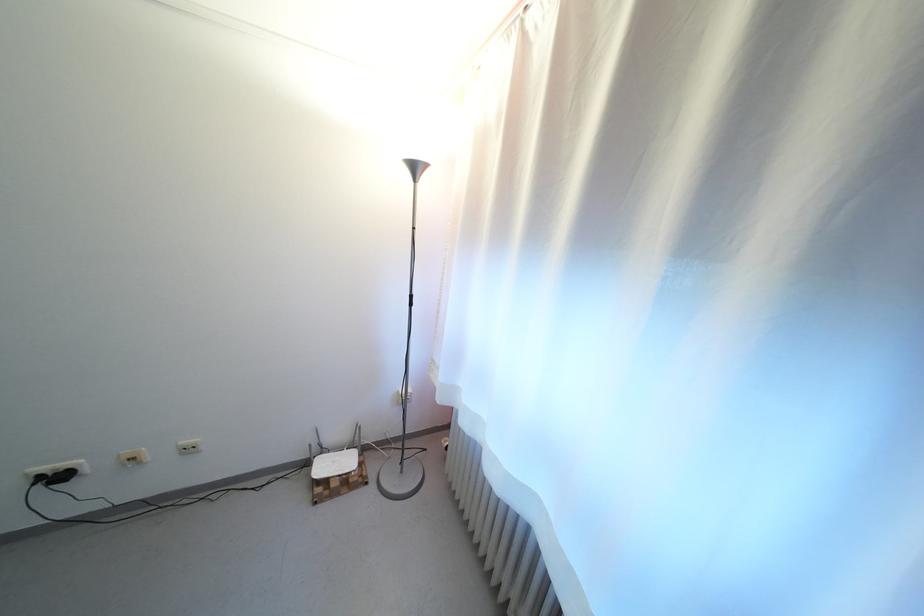
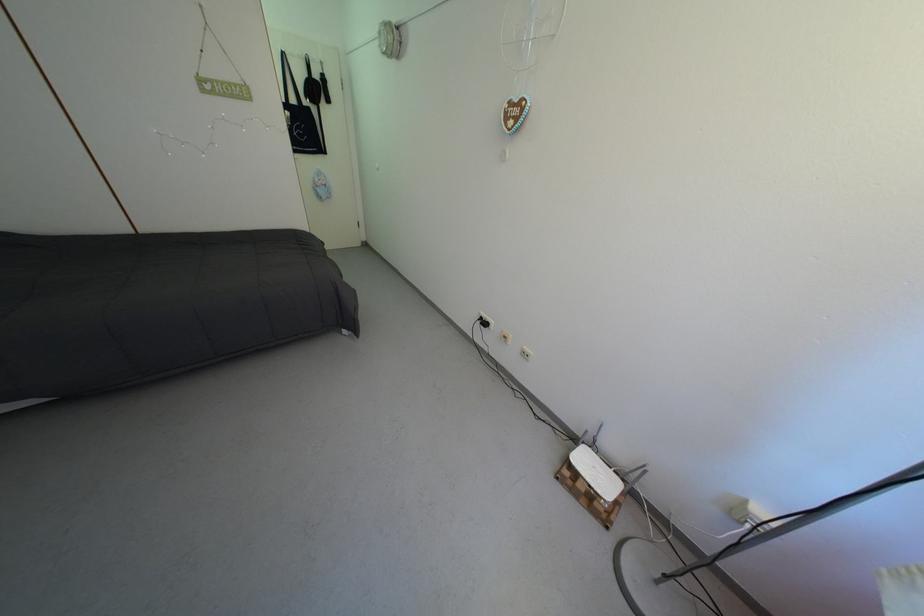
Based on the continuous images, in which direction is the camera rotating?

The rotation direction of the camera is left-down.